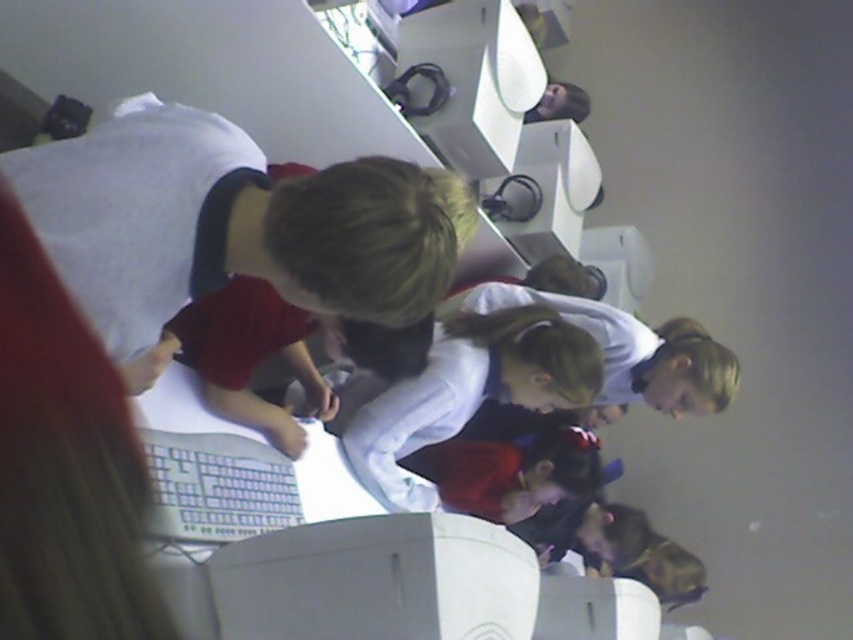
Question: Observing the image, what is the correct spatial positioning of matte red shirt at center in reference to white glossy monitor at center?

Choices:
 (A) below
 (B) above

Answer: (B)

Question: Estimate the real-world distances between objects in this image. Which object is closer to the white glossy monitor at center?

Choices:
 (A) dark red fabric at center
 (B) matte red shirt at center

Answer: (B)

Question: Which point appears closest to the camera in this image?

Choices:
 (A) (448, 499)
 (B) (428, 371)
 (C) (308, 582)

Answer: (C)

Question: Which point is farther to the camera?

Choices:
 (A) matte red shirt at center
 (B) dark red fabric at center

Answer: (B)

Question: Considering the relative positions of white matte shirt at center and dark red fabric at center in the image provided, where is white matte shirt at center located with respect to dark red fabric at center?

Choices:
 (A) right
 (B) left

Answer: (B)

Question: Is white matte shirt at center below dark red fabric at center?

Choices:
 (A) yes
 (B) no

Answer: (B)